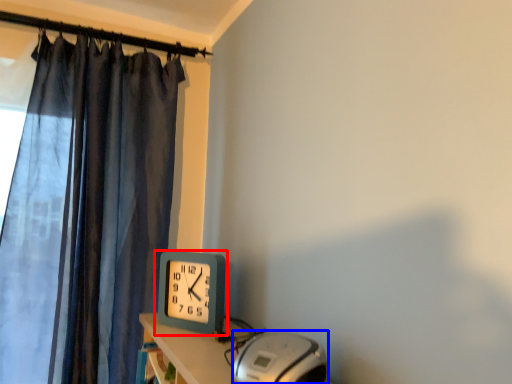
Question: Which object appears farthest to the camera in this image, wall clock (highlighted by a red box) or equipment (highlighted by a blue box)?

Choices:
 (A) wall clock
 (B) equipment

Answer: (A)